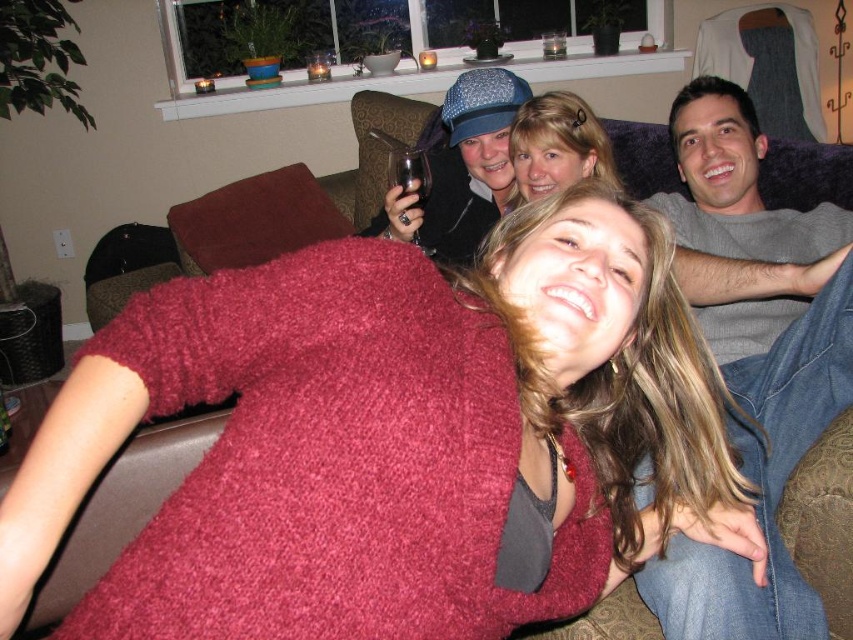
Question: Which object appears farthest from the camera in this image?

Choices:
 (A) blonde hair at center
 (B) gray soft shirt at upper right
 (C) fuzzy red sweater at center

Answer: (A)

Question: Among these objects, which one is nearest to the camera?

Choices:
 (A) blonde hair at center
 (B) fuzzy red sweater at center
 (C) gray soft shirt at upper right

Answer: (B)

Question: Among these points, which one is nearest to the camera?

Choices:
 (A) (535, 100)
 (B) (440, 444)

Answer: (B)

Question: From the image, what is the correct spatial relationship of fuzzy red sweater at center in relation to gray soft blanket at upper right?

Choices:
 (A) right
 (B) left

Answer: (B)

Question: Can you confirm if fuzzy red sweater at center is bigger than blonde hair at center?

Choices:
 (A) yes
 (B) no

Answer: (A)

Question: Is fuzzy red sweater at center further to camera compared to gray soft shirt at upper right?

Choices:
 (A) yes
 (B) no

Answer: (B)